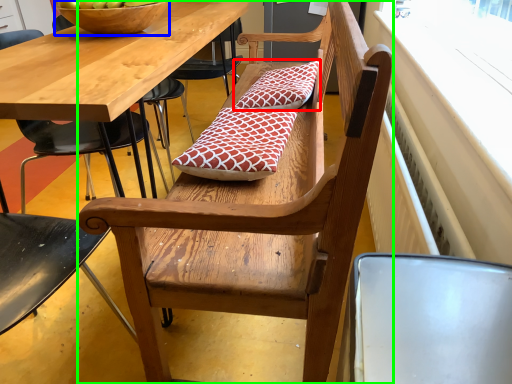
Question: Considering the real-world distances, which object is farthest from pillow (highlighted by a red box)? bowl (highlighted by a blue box) or bench (highlighted by a green box)?

Choices:
 (A) bowl
 (B) bench

Answer: (B)